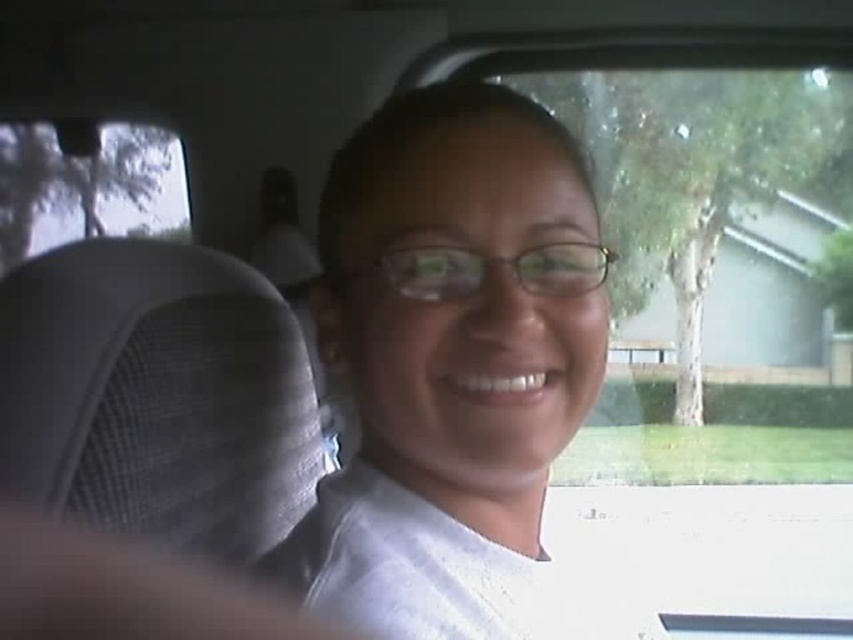
Question: Which object is farther from the camera taking this photo?

Choices:
 (A) transparent glass car window at upper left
 (B) gray mesh headrest at left

Answer: (A)

Question: Which of these objects is positioned closest to the white matte shirt at center?

Choices:
 (A) transparent glass car window at upper left
 (B) gray mesh headrest at left

Answer: (B)

Question: Observing the image, what is the correct spatial positioning of white matte shirt at center in reference to gray mesh headrest at left?

Choices:
 (A) right
 (B) left

Answer: (A)

Question: Does white matte shirt at center appear under gray mesh headrest at left?

Choices:
 (A) yes
 (B) no

Answer: (B)

Question: Can you confirm if white matte shirt at center is smaller than gray mesh headrest at left?

Choices:
 (A) yes
 (B) no

Answer: (B)

Question: Which of the following is the farthest from the observer?

Choices:
 (A) white matte shirt at center
 (B) gray mesh headrest at left

Answer: (A)